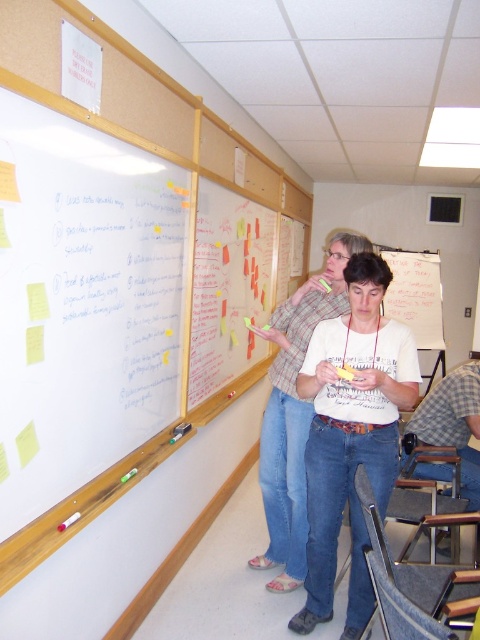
Question: Which point is closer to the camera?

Choices:
 (A) white cotton shirt at center
 (B) white matte dry erase board at upper left

Answer: (B)

Question: Which object is closer to the camera taking this photo?

Choices:
 (A) white matte dry erase board at upper left
 (B) white cotton shirt at center

Answer: (A)

Question: Is white matte dry erase board at upper left thinner than white cotton shirt at center?

Choices:
 (A) no
 (B) yes

Answer: (B)

Question: Which of the following is the closest to the observer?

Choices:
 (A) (118, 444)
 (B) (331, 616)

Answer: (A)

Question: Can you confirm if white matte dry erase board at upper left is smaller than white cotton shirt at center?

Choices:
 (A) yes
 (B) no

Answer: (B)

Question: Can you confirm if white matte dry erase board at upper left is smaller than white cotton shirt at center?

Choices:
 (A) yes
 (B) no

Answer: (B)